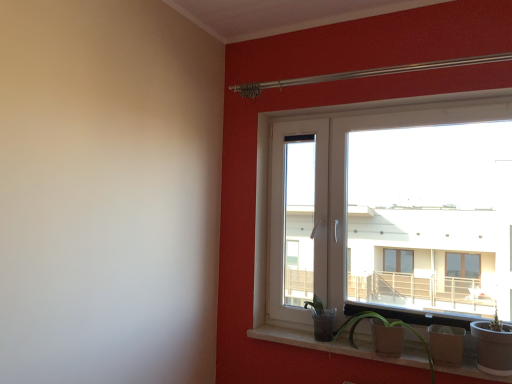
Question: In terms of width, does white plastic window at upper right look wider or thinner when compared to matte concrete window sill at lower center?

Choices:
 (A) thin
 (B) wide

Answer: (A)

Question: Is white plastic window at upper right to the left or to the right of matte concrete window sill at lower center in the image?

Choices:
 (A) right
 (B) left

Answer: (A)

Question: Which is farther from the matte concrete window sill at lower center?

Choices:
 (A) green matte vase at lower center
 (B) matte brown pot at lower right
 (C) white plastic window at upper right

Answer: (C)

Question: Which object is positioned farthest from the matte concrete window sill at lower center?

Choices:
 (A) green matte vase at lower center
 (B) white plastic window at upper right
 (C) matte brown pot at lower right

Answer: (B)